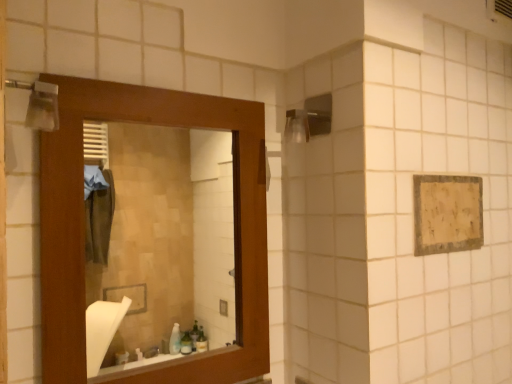
Where is `beige textured towel at upper right`? Image resolution: width=512 pixels, height=384 pixels. beige textured towel at upper right is located at coordinates (447, 213).

The image size is (512, 384). Describe the element at coordinates (447, 213) in the screenshot. I see `beige textured towel at upper right` at that location.

Measure the distance between point (422, 230) and camera.

Point (422, 230) is 3.57 feet from camera.

The height and width of the screenshot is (384, 512). Identify the location of wooden mirror at left. (159, 241).

Describe the element at coordinates (159, 241) in the screenshot. I see `wooden mirror at left` at that location.

You are a GUI agent. You are given a task and a screenshot of the screen. Output one action in this format:
    pyautogui.click(x=<x>, y=<y>)
    Task: Click on the beige textured towel at upper right
    The image size is (512, 384).
    Given the screenshot: What is the action you would take?
    pyautogui.click(x=447, y=213)

Is wooden mirror at left to the left or to the right of beige textured towel at upper right in the image?

Clearly, wooden mirror at left is on the left of beige textured towel at upper right in the image.

In the image, is wooden mirror at left positioned in front of or behind beige textured towel at upper right?

In the image, wooden mirror at left appears in front of beige textured towel at upper right.

Between point (204, 341) and point (423, 249), which one is positioned in front?

The point (423, 249) is closer to the camera.

From the image's perspective, which is above, wooden mirror at left or beige textured towel at upper right?

beige textured towel at upper right, from the image's perspective.

From a real-world perspective, does wooden mirror at left stand above beige textured towel at upper right?

No, from a real-world perspective, wooden mirror at left is not on top of beige textured towel at upper right.

Based on the photo, considering the sizes of wooden mirror at left and beige textured towel at upper right in the image, is wooden mirror at left wider or thinner than beige textured towel at upper right?

Considering their sizes, wooden mirror at left looks broader than beige textured towel at upper right.

Considering the sizes of objects wooden mirror at left and beige textured towel at upper right in the image provided, who is taller, wooden mirror at left or beige textured towel at upper right?

Standing taller between the two is wooden mirror at left.

Which of these two, wooden mirror at left or beige textured towel at upper right, is bigger?

wooden mirror at left.

Could beige textured towel at upper right be considered to be inside wooden mirror at left?

No, beige textured towel at upper right is located outside of wooden mirror at left.

Does wooden mirror at left touch beige textured towel at upper right?

No, wooden mirror at left is not beside beige textured towel at upper right.

Is wooden mirror at left positioned with its back to beige textured towel at upper right?

No, beige textured towel at upper right is not at the back of wooden mirror at left.

How distant is wooden mirror at left from beige textured towel at upper right?

They are 2.11 meters apart.

Locate an element on the screen. mirror below the beige textured towel at upper right (from the image's perspective) is located at coordinates (159, 241).

Based on their positions, is beige textured towel at upper right located to the left or right of wooden mirror at left?

In the image, beige textured towel at upper right appears on the right side of wooden mirror at left.

Which is behind, beige textured towel at upper right or wooden mirror at left?

beige textured towel at upper right.

Is point (467, 245) less distant than point (100, 331)?

Yes, it is in front of point (100, 331).

Looking at this image, from the image's perspective, which one is positioned lower, beige textured towel at upper right or wooden mirror at left?

wooden mirror at left is shown below in the image.

From a real-world perspective, is beige textured towel at upper right physically located above or below wooden mirror at left?

Clearly, from a real-world perspective, beige textured towel at upper right is above wooden mirror at left.

Does beige textured towel at upper right have a lesser width compared to wooden mirror at left?

Indeed, beige textured towel at upper right has a lesser width compared to wooden mirror at left.

Which of these two, beige textured towel at upper right or wooden mirror at left, stands taller?

wooden mirror at left.

Between beige textured towel at upper right and wooden mirror at left, which one has smaller size?

beige textured towel at upper right is smaller.

Is beige textured towel at upper right spatially inside wooden mirror at left, or outside of it?

beige textured towel at upper right exists outside the volume of wooden mirror at left.

Would you say beige textured towel at upper right is a long distance from wooden mirror at left?

Absolutely, beige textured towel at upper right is distant from wooden mirror at left.

Is beige textured towel at upper right looking in the opposite direction of wooden mirror at left?

No, beige textured towel at upper right is not facing away from wooden mirror at left.

What's the angular difference between beige textured towel at upper right and wooden mirror at left's facing directions?

0.00277 degrees separate the facing orientations of beige textured towel at upper right and wooden mirror at left.

The width and height of the screenshot is (512, 384). What are the coordinates of `mirror below the beige textured towel at upper right (from a real-world perspective)` in the screenshot? It's located at (159, 241).

You are a GUI agent. You are given a task and a screenshot of the screen. Output one action in this format:
    pyautogui.click(x=<x>, y=<y>)
    Task: Click on the square on the right side of wooden mirror at left
    
    Given the screenshot: What is the action you would take?
    pyautogui.click(x=447, y=213)

The image size is (512, 384). Identify the location of square above the wooden mirror at left (from a real-world perspective). (447, 213).